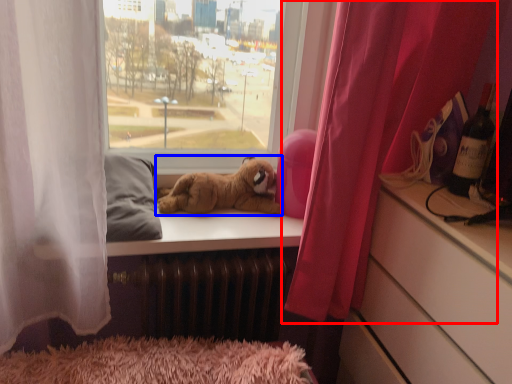
Question: Among these objects, which one is farthest to the camera, curtain (highlighted by a red box) or dog (highlighted by a blue box)?

Choices:
 (A) curtain
 (B) dog

Answer: (B)